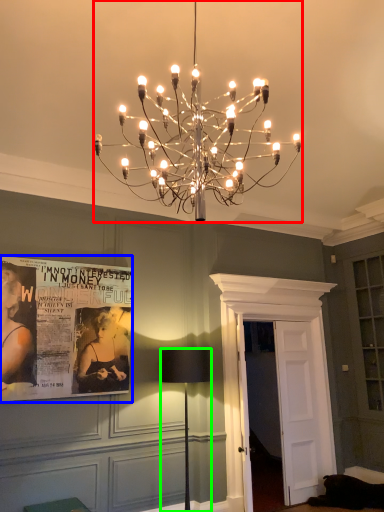
Question: Based on their relative distances, which object is nearer to lamp (highlighted by a red box)? Choose from poster page (highlighted by a blue box) and lamp (highlighted by a green box).

Choices:
 (A) poster page
 (B) lamp

Answer: (A)